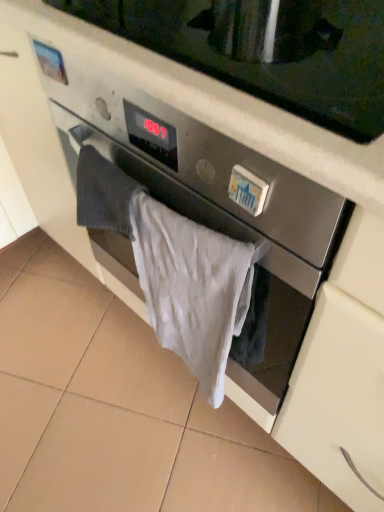
Question: In terms of width, does white cotton towel at center look wider or thinner when compared to satin silver microwave at center?

Choices:
 (A) wide
 (B) thin

Answer: (B)

Question: In the image, is white cotton towel at center positioned in front of or behind satin silver microwave at center?

Choices:
 (A) behind
 (B) front

Answer: (A)

Question: Would you say white cotton towel at center is inside or outside satin silver microwave at center?

Choices:
 (A) outside
 (B) inside

Answer: (A)

Question: Based on their sizes in the image, would you say satin silver microwave at center is bigger or smaller than white cotton towel at center?

Choices:
 (A) big
 (B) small

Answer: (A)

Question: Visually, is satin silver microwave at center positioned to the left or to the right of white cotton towel at center?

Choices:
 (A) right
 (B) left

Answer: (A)

Question: In terms of width, does satin silver microwave at center look wider or thinner when compared to white cotton towel at center?

Choices:
 (A) thin
 (B) wide

Answer: (B)

Question: From the image's perspective, relative to white cotton towel at center, is satin silver microwave at center above or below?

Choices:
 (A) above
 (B) below

Answer: (A)